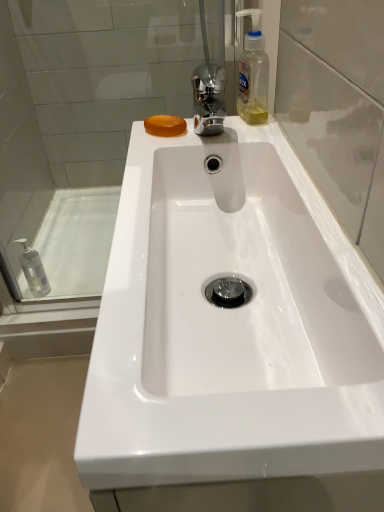
Image resolution: width=384 pixels, height=512 pixels. Identify the location of vacant area that is in front of clear plastic bottle at upper right. (252, 137).